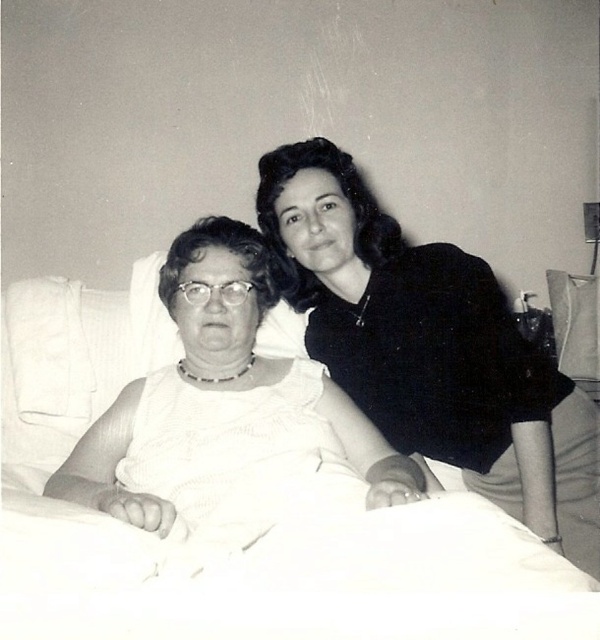
You are a nurse in a hospital room. You need to place a medical chart on the bed and a syringe on the floor. The medical chart must be placed at point (45, 532) and the syringe at point (286, 250). From the perspective of the patient in the bed, which item will be closer to them?

The medical chart placed at point (45, 532) will be closer to the patient in the bed because it is positioned in front of the syringe at point (286, 250).

You are a nurse in a hospital room. You see two white fabrics in the image. Which one is closer to you, the white fabric at upper right or the white fabric at center?

The white fabric at upper right is closer to you because the white fabric at center is behind it.

You are a photographer adjusting your camera settings in a hospital room scene. You need to focus on two specific points marked as point 1 and point 2. Given that point 1 is at coordinate (505, 387) and point 2 is at (97, 420), which point should you prioritize focusing on first if you want to ensure the subject closest to the camera is sharp?

Point 1 at coordinate (505, 387) should be prioritized because it is closer to the camera than point 2 at (97, 420), ensuring the nearest subject is in focus.